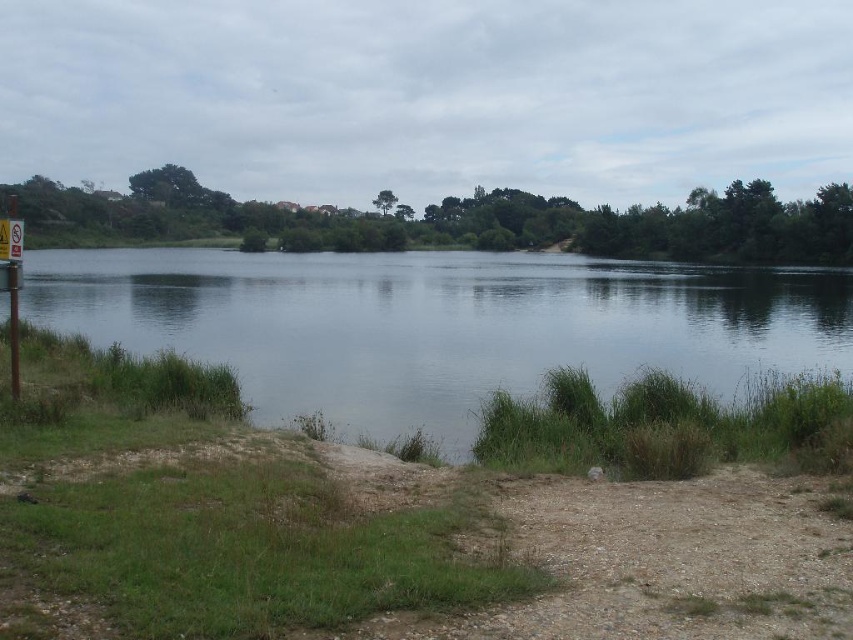
Question: Which point is farther to the camera?

Choices:
 (A) (15, 241)
 (B) (207, 275)

Answer: (B)

Question: Is clear water at center positioned at the back of metal sign at left?

Choices:
 (A) no
 (B) yes

Answer: (B)

Question: Which point appears closest to the camera in this image?

Choices:
 (A) (7, 236)
 (B) (479, 392)

Answer: (A)

Question: Does clear water at center have a greater width compared to metal sign at left?

Choices:
 (A) yes
 (B) no

Answer: (A)

Question: Which point is farther to the camera?

Choices:
 (A) (13, 253)
 (B) (805, 273)

Answer: (B)

Question: In this image, where is clear water at center located relative to metal sign at left?

Choices:
 (A) below
 (B) above

Answer: (B)